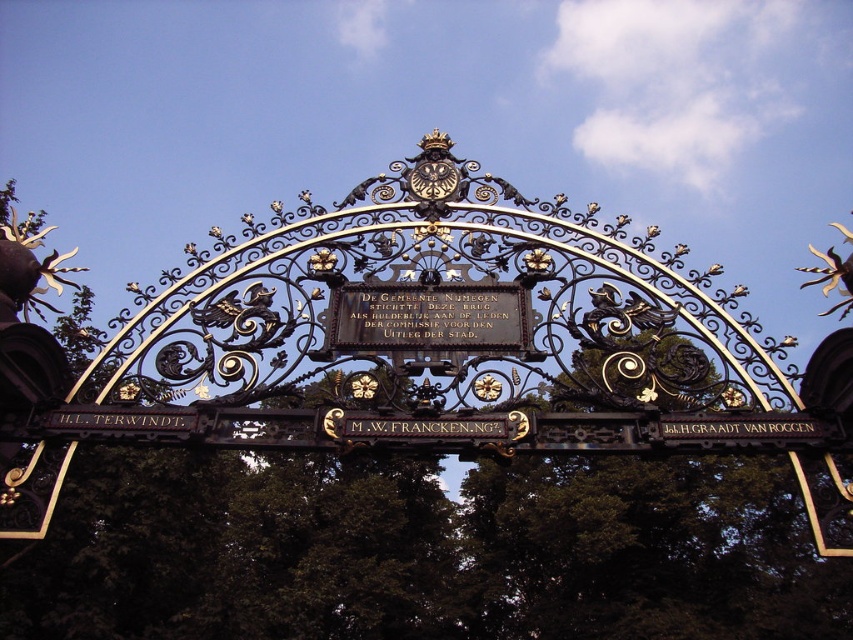
In the scene shown: Who is positioned more to the right, green leafy tree at center or black polished wood plaque at center?

black polished wood plaque at center

This screenshot has width=853, height=640. What do you see at coordinates (421, 552) in the screenshot? I see `green leafy tree at center` at bounding box center [421, 552].

What do you see at coordinates (421, 552) in the screenshot? Image resolution: width=853 pixels, height=640 pixels. I see `green leafy tree at center` at bounding box center [421, 552].

You are a GUI agent. You are given a task and a screenshot of the screen. Output one action in this format:
    pyautogui.click(x=<x>, y=<y>)
    Task: Click on the green leafy tree at center
    
    Given the screenshot: What is the action you would take?
    [421, 552]